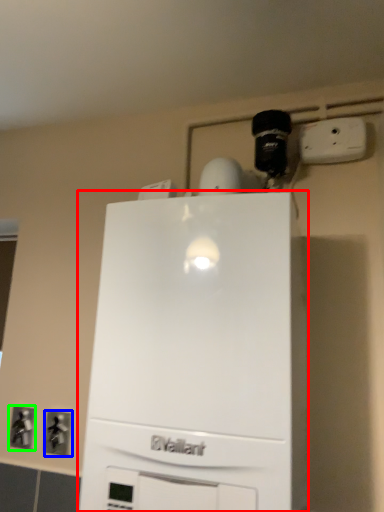
Question: Considering the real-world distances, which object is farthest from home appliance (highlighted by a red box)? electric outlet (highlighted by a blue box) or electric outlet (highlighted by a green box)?

Choices:
 (A) electric outlet
 (B) electric outlet

Answer: (B)